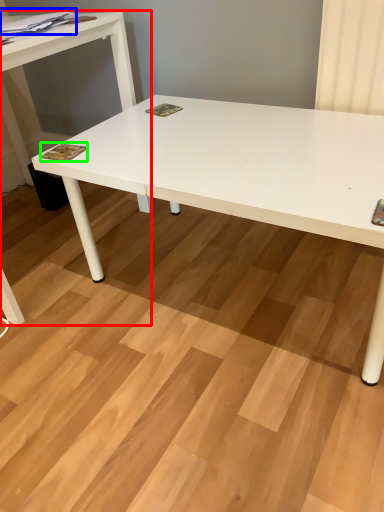
Question: Estimate the real-world distances between objects in this image. Which object is farther from table (highlighted by a red box), magazine (highlighted by a blue box) or magazine (highlighted by a green box)?

Choices:
 (A) magazine
 (B) magazine

Answer: (B)